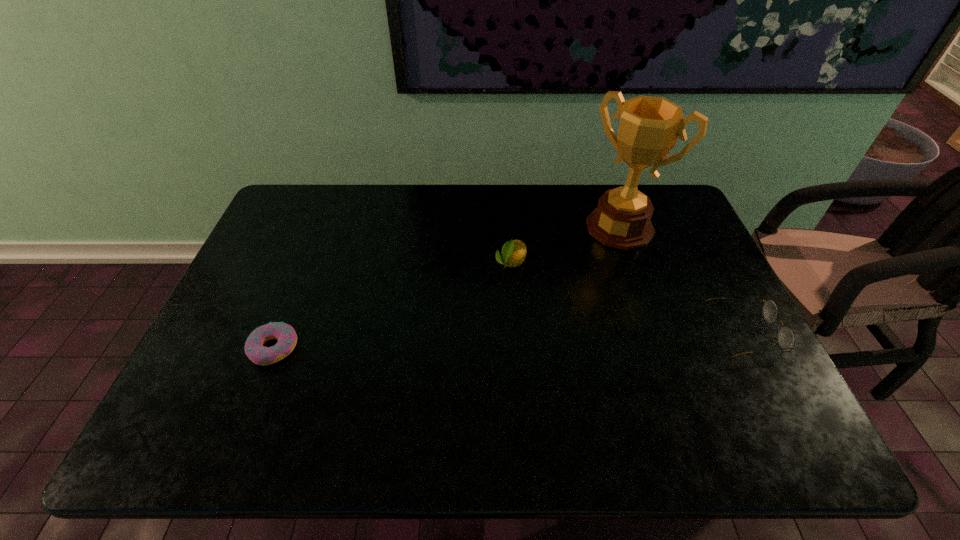
I want to click on free spot on the desktop that is between the doughnut and the third tallest object and is positioned on the front-facing side of the farthest object, so click(x=525, y=340).

You are a GUI agent. You are given a task and a screenshot of the screen. Output one action in this format:
    pyautogui.click(x=<x>, y=<y>)
    Task: Click on the free spot on the desktop that is between the doughnut and the spectacles and is positioned with leaves positioned above the second tallest object
    This screenshot has width=960, height=540.
    Given the screenshot: What is the action you would take?
    458,342